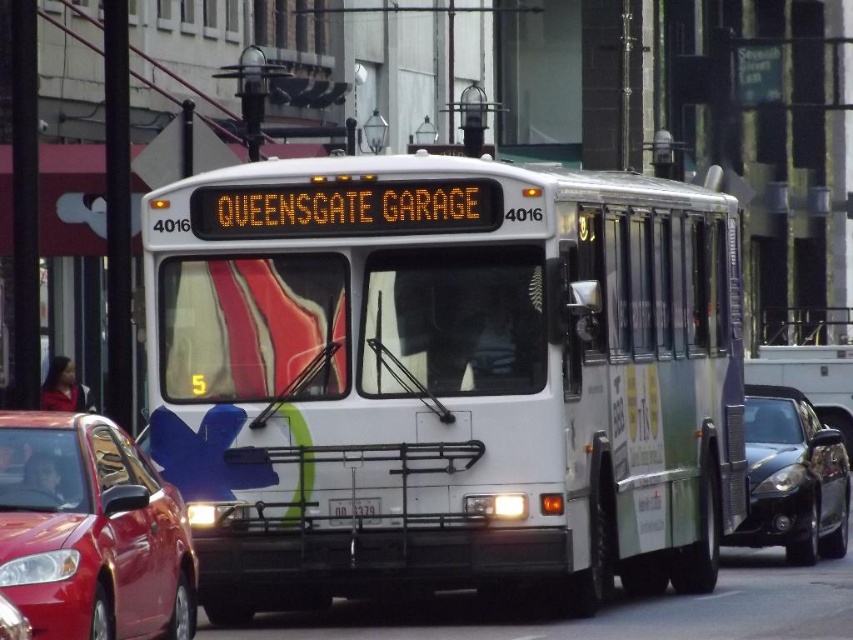
Question: Which object is closer to the camera taking this photo?

Choices:
 (A) shiny red sedan at left
 (B) white matte bus at center
 (C) white plastic license plate at center

Answer: (A)

Question: Does shiny red sedan at left appear under white plastic license plate at center?

Choices:
 (A) yes
 (B) no

Answer: (B)

Question: Which point is closer to the camera taking this photo?

Choices:
 (A) (643, 211)
 (B) (64, 429)

Answer: (B)

Question: Which of these objects is positioned farthest from the shiny black sedan at right?

Choices:
 (A) white plastic license plate at center
 (B) white matte bus at center
 (C) shiny red sedan at left

Answer: (C)

Question: Can you confirm if shiny black sedan at right is positioned to the left of white plastic license plate at center?

Choices:
 (A) no
 (B) yes

Answer: (A)

Question: Is white matte bus at center further to camera compared to white plastic license plate at center?

Choices:
 (A) no
 (B) yes

Answer: (B)